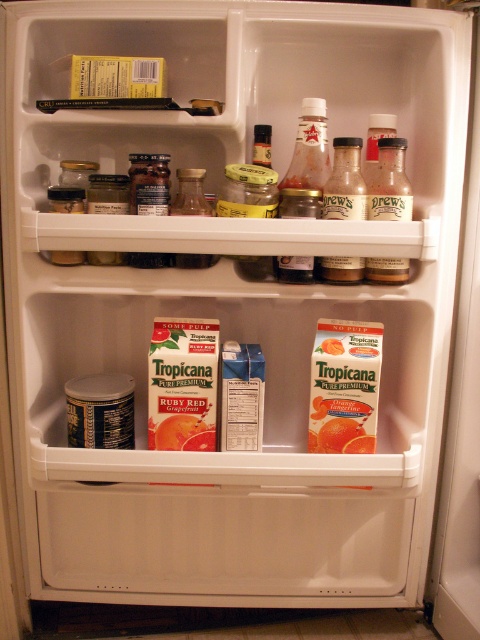
You are organizing the fridge and want to place a new jar between the matte glass bottle at upper right and the clear glass jar at center. Is there enough space between them to fit a jar that is 5 cm wide?

The matte glass bottle at upper right is positioned on the right side of clear glass jar at center, so there is space between them. However, the exact width isn not provided, so we cannot confirm if it can fit a 5 cm wide jar.